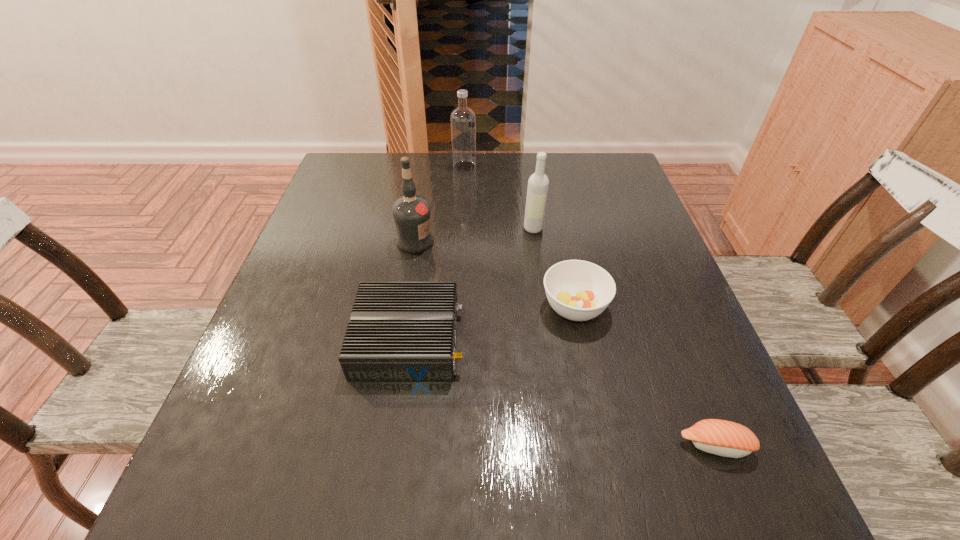
Where is `vacant space located on the front of the rightmost vodka`? The height and width of the screenshot is (540, 960). vacant space located on the front of the rightmost vodka is located at coordinates (546, 315).

The height and width of the screenshot is (540, 960). Identify the location of vacant point located on the back panel of the router. (625, 340).

You are a GUI agent. You are given a task and a screenshot of the screen. Output one action in this format:
    pyautogui.click(x=<x>, y=<y>)
    Task: Click on the vacant region located on the front of the soup bowl
    
    Given the screenshot: What is the action you would take?
    pyautogui.click(x=611, y=481)

Identify the location of blank area located on the left of the sushi. (578, 446).

The image size is (960, 540). I want to click on object positioned at the far edge, so click(x=463, y=120).

Locate an element on the screen. The image size is (960, 540). soup bowl that is at the right edge is located at coordinates (577, 290).

Where is `sushi at the right edge`? This screenshot has height=540, width=960. sushi at the right edge is located at coordinates (724, 438).

Locate an element on the screen. The image size is (960, 540). vacant space at the left edge of the desktop is located at coordinates (296, 264).

Locate an element on the screen. The width and height of the screenshot is (960, 540). vacant space at the right edge of the desktop is located at coordinates (696, 339).

The image size is (960, 540). In order to click on vacant position at the far left corner of the desktop in this screenshot , I will do `click(371, 172)`.